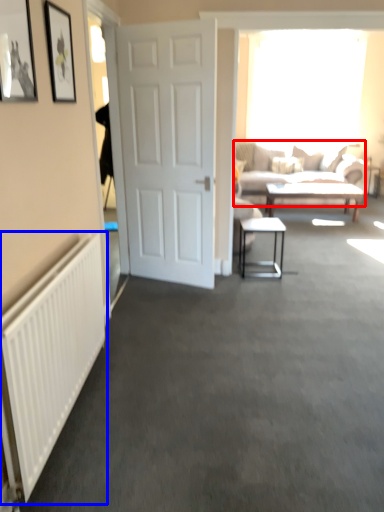
Question: Which point is further to the camera, studio couch (highlighted by a red box) or radiator (highlighted by a blue box)?

Choices:
 (A) studio couch
 (B) radiator

Answer: (A)